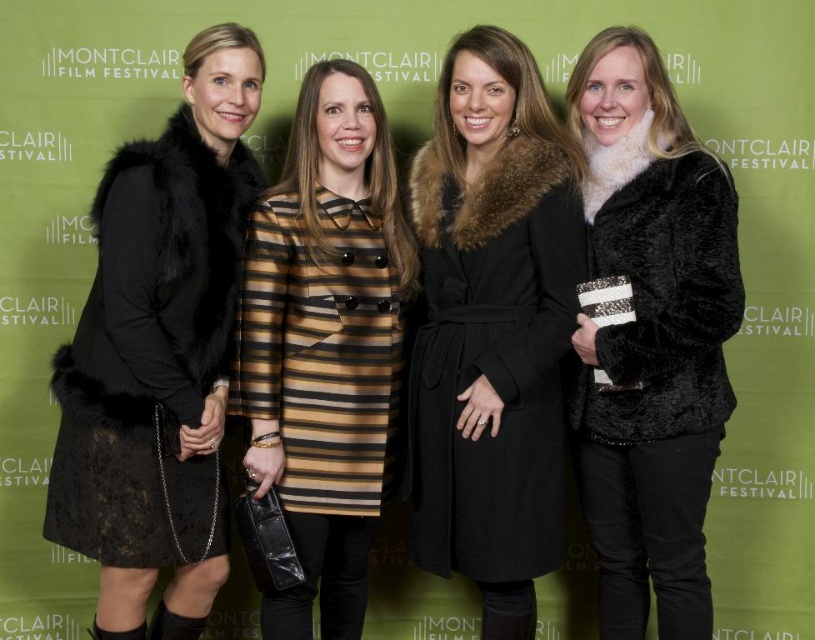
Question: Is fuzzy black coat at right to the right of striped fabric dress at center from the viewer's perspective?

Choices:
 (A) no
 (B) yes

Answer: (B)

Question: Among these objects, which one is farthest from the camera?

Choices:
 (A) striped fabric dress at center
 (B) fuzzy black coat at right
 (C) velvet black dress at left
 (D) black suede boot at lower left

Answer: (D)

Question: Which of the following is the farthest from the observer?

Choices:
 (A) striped fabric dress at center
 (B) fuzzy black coat at right

Answer: (A)

Question: Which of the following is the closest to the observer?

Choices:
 (A) (166, 621)
 (B) (654, 422)
 (C) (102, 636)

Answer: (B)

Question: Is black wool coat at center positioned behind striped fabric dress at center?

Choices:
 (A) yes
 (B) no

Answer: (B)

Question: Is black wool coat at center bigger than striped fabric dress at center?

Choices:
 (A) no
 (B) yes

Answer: (A)